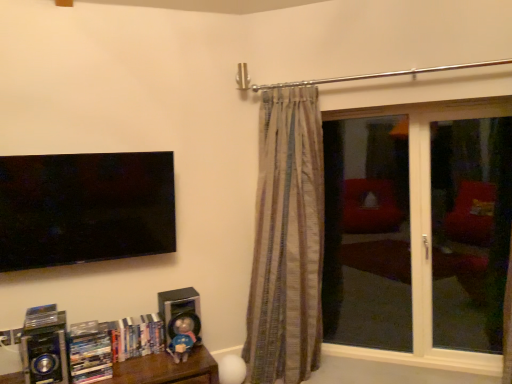
Question: From the image's perspective, is transparent glass window at right located beneath matte plastic books at lower left?

Choices:
 (A) yes
 (B) no

Answer: (B)

Question: From a real-world perspective, is transparent glass window at right located beneath matte plastic books at lower left?

Choices:
 (A) no
 (B) yes

Answer: (A)

Question: Is transparent glass window at right positioned with its back to matte plastic books at lower left?

Choices:
 (A) no
 (B) yes

Answer: (A)

Question: Would you say transparent glass window at right contains matte plastic books at lower left?

Choices:
 (A) yes
 (B) no

Answer: (B)

Question: Does transparent glass window at right turn towards matte plastic books at lower left?

Choices:
 (A) yes
 (B) no

Answer: (B)

Question: Is transparent glass window at right wider than matte plastic books at lower left?

Choices:
 (A) no
 (B) yes

Answer: (A)

Question: Is silver metallic speaker at lower center, which is the 1th speaker in back-to-front order, located within transparent glass screen door at right, which is the 2th screen door from right to left?

Choices:
 (A) no
 (B) yes

Answer: (A)

Question: Can you confirm if transparent glass screen door at right, the 1th screen door when ordered from left to right, is smaller than silver metallic speaker at lower center, the 2th speaker in the left-to-right sequence?

Choices:
 (A) yes
 (B) no

Answer: (B)

Question: From a real-world perspective, is transparent glass screen door at right, the 1th screen door when ordered from left to right, on silver metallic speaker at lower center, which is the 2th speaker from front to back?

Choices:
 (A) yes
 (B) no

Answer: (A)

Question: From a real-world perspective, is transparent glass screen door at right, the 1th screen door when ordered from left to right, physically below silver metallic speaker at lower center, the 2th speaker in the left-to-right sequence?

Choices:
 (A) no
 (B) yes

Answer: (A)

Question: From the image's perspective, is transparent glass screen door at right, which is the 2th screen door from right to left, located beneath silver metallic speaker at lower center, acting as the 1th speaker starting from the right?

Choices:
 (A) no
 (B) yes

Answer: (A)

Question: Is transparent glass screen door at right, the 1th screen door when ordered from left to right, facing towards silver metallic speaker at lower center, the 2th speaker in the left-to-right sequence?

Choices:
 (A) yes
 (B) no

Answer: (B)

Question: Is metallic blue speaker at lower left, which is the 2th speaker from right to left, aimed at metallic silver stereo at lower left?

Choices:
 (A) no
 (B) yes

Answer: (A)